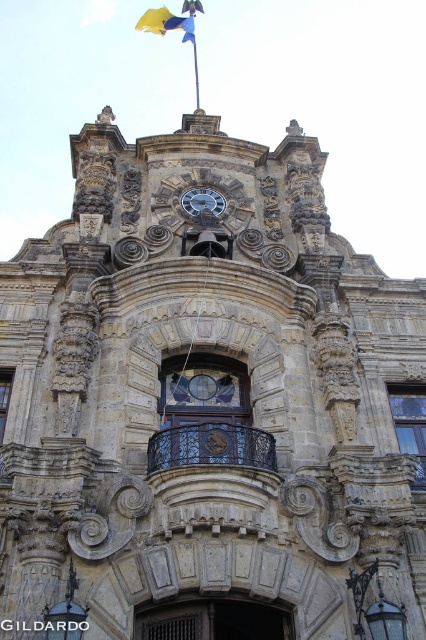
You are standing in front of the grand building and notice the black wrought iron balcony at center. Can you determine its exact position relative to the clock and flagpole?

The black wrought iron balcony at center is positioned at coordinates point (210, 445), which places it near the central area of the building, between the clock and the flagpole above it.

Looking at this image, you are an architect analyzing the building facade. You need to compare the widths of the yellow fabric flag at top and the silver metallic clock at center. Which one is wider?

The yellow fabric flag at top is wider than the silver metallic clock at center.

You are an architect examining the building from the ground level. You notice the black wrought iron balcony at center and the silver metallic clock at center. Which object is positioned lower in the structure?

The black wrought iron balcony at center is below the silver metallic clock at center, so the balcony is positioned lower in the structure.